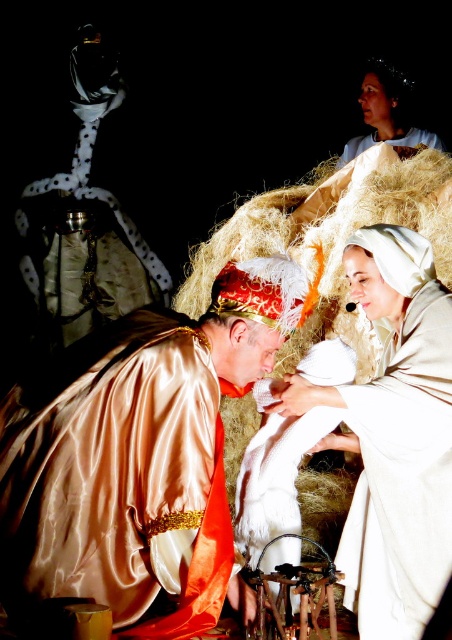
You are a stagehand in a theater. You need to place a white linen cloth at center on the stage. The stage is 30 meters long. Can you safely place the cloth at center without it being too close to the front edge of the stage?

The white linen cloth at center is 28.61 meters from the camera, which is within the 30 meter length of the stage. Therefore, it can be safely placed at center without being too close to the front edge.

Based on the photo, you are an assistant helping to set up the stage for a play. You have to place a white linen cloth at center and a white cotton robe at upper center. According to the scene description, which object should be placed higher up to match the original image?

The white linen cloth at center should be placed higher up than the white cotton robe at upper center because the white linen cloth at center is taller than the white cotton robe at upper center in the original image.